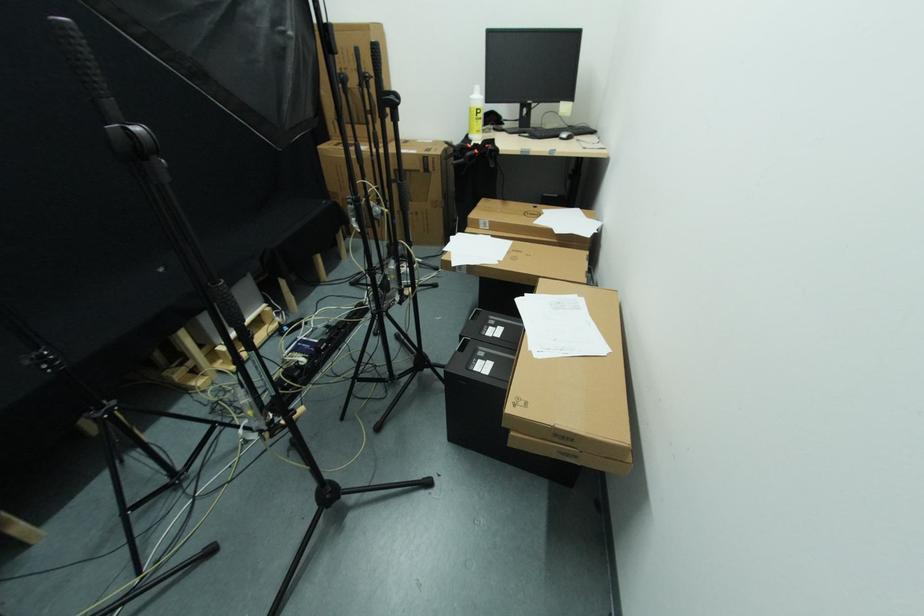
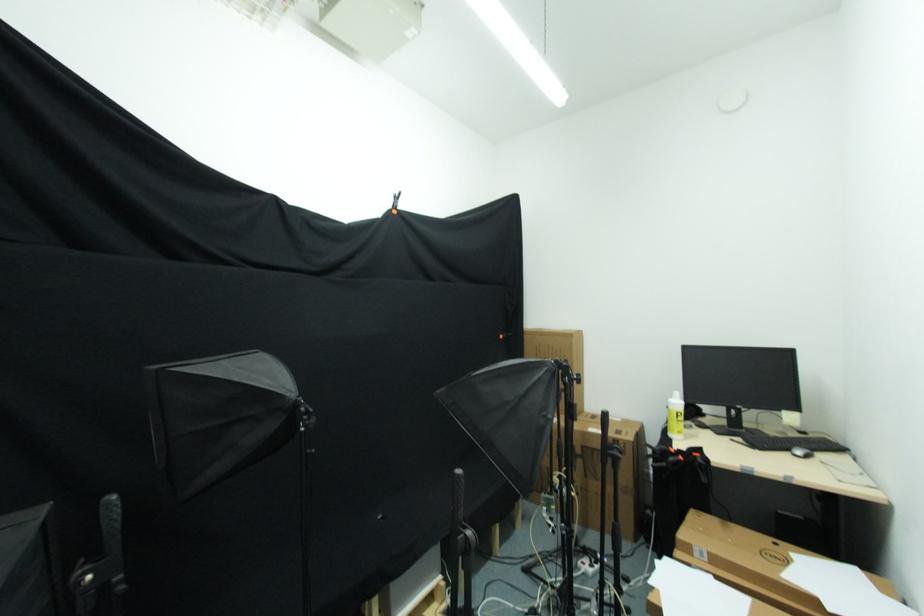
Based on the continuous images, in which direction is the camera rotating?

The camera's rotation is toward left-up.